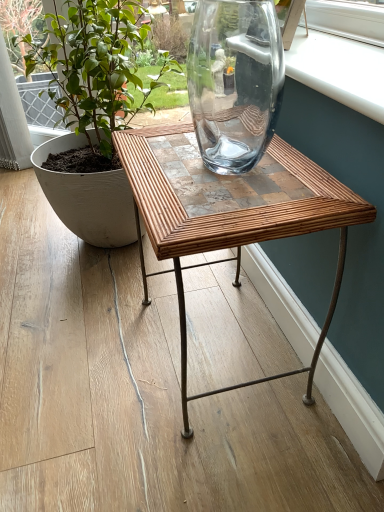
The height and width of the screenshot is (512, 384). In order to click on empty space that is ontop of bamboowoodentable at center (from a real-world perspective) in this screenshot , I will do `click(219, 159)`.